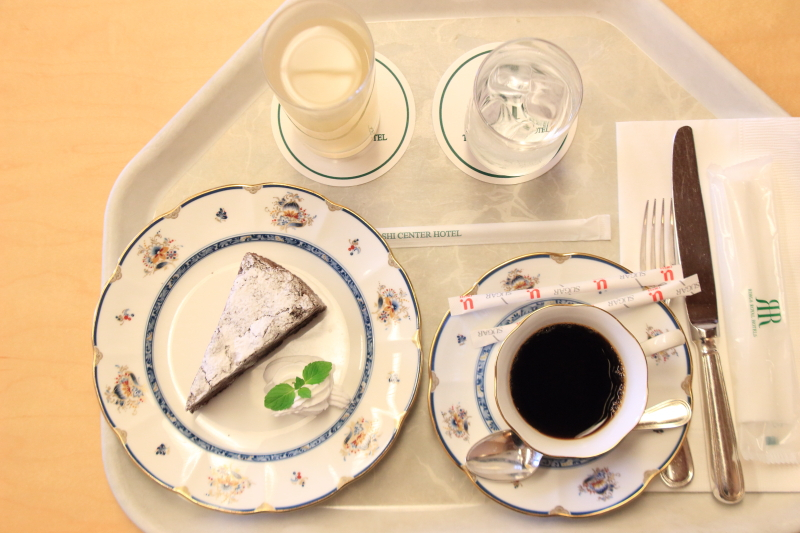
Where is `fine china`? fine china is located at coordinates (244, 219), (465, 363), (549, 313).